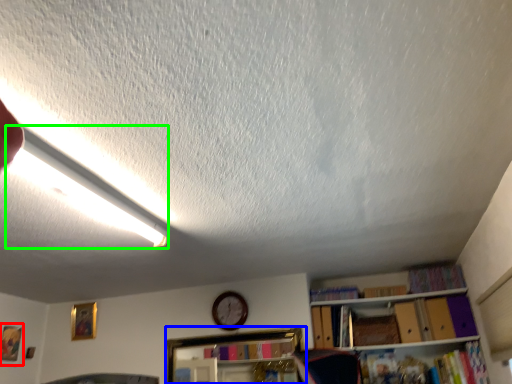
Question: Which object is the closest to the picture frame (highlighted by a red box)? Choose among these: shelf (highlighted by a blue box) or light (highlighted by a green box).

Choices:
 (A) shelf
 (B) light

Answer: (A)